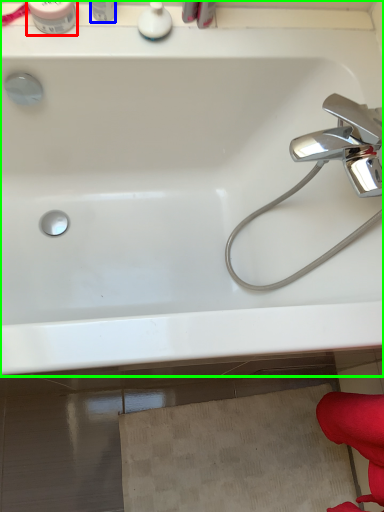
Question: Based on their relative distances, which object is nearer to toiletry (highlighted by a red box)? Choose from toiletry (highlighted by a blue box) and bathtub (highlighted by a green box).

Choices:
 (A) toiletry
 (B) bathtub

Answer: (A)